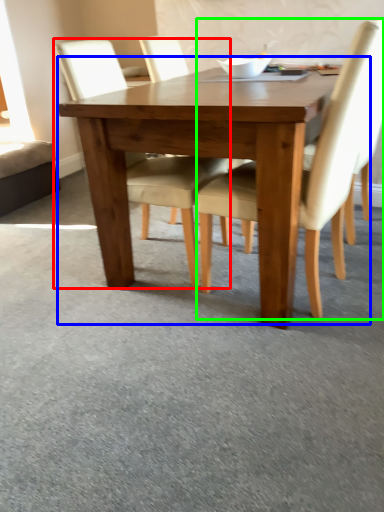
Question: Considering the real-world distances, which object is farthest from chair (highlighted by a red box)? kitchen & dining room table (highlighted by a blue box) or chair (highlighted by a green box)?

Choices:
 (A) kitchen & dining room table
 (B) chair

Answer: (B)